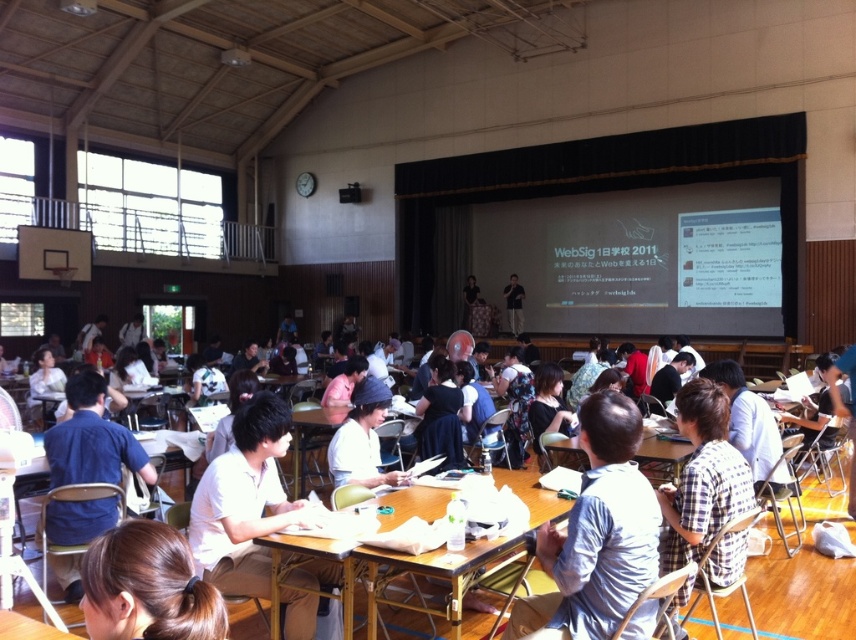
Does point (634, 490) lie in front of point (423, 504)?

Yes, point (634, 490) is closer to viewer.

Who is lower down, white shirt at center or wooden table at center?

wooden table at center is below.

Describe the element at coordinates (596, 534) in the screenshot. I see `white shirt at center` at that location.

Where is `white shirt at center`? Image resolution: width=856 pixels, height=640 pixels. white shirt at center is located at coordinates (596, 534).

Is white shirt at center wider than brown hair at lower left?

Indeed, white shirt at center has a greater width compared to brown hair at lower left.

Is white shirt at center above brown hair at lower left?

Actually, white shirt at center is below brown hair at lower left.

Who is more distant from viewer, (607, 394) or (200, 602)?

Positioned behind is point (607, 394).

Where is `white shirt at center`? white shirt at center is located at coordinates (596, 534).

Who is positioned more to the right, white matte shirt at center or white fabric cap at center?

white fabric cap at center

In the scene shown: Does white matte shirt at center lie in front of white fabric cap at center?

Yes.

This screenshot has width=856, height=640. What do you see at coordinates (242, 500) in the screenshot?
I see `white matte shirt at center` at bounding box center [242, 500].

You are a GUI agent. You are given a task and a screenshot of the screen. Output one action in this format:
    pyautogui.click(x=<x>, y=<y>)
    Task: Click on the white matte shirt at center
    
    Given the screenshot: What is the action you would take?
    pyautogui.click(x=242, y=500)